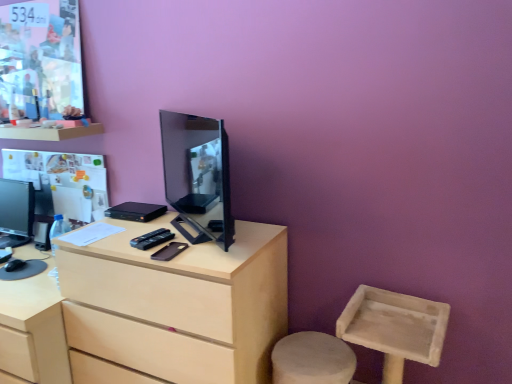
Question: Does matte black monitor at left, arranged as the 2th television when viewed from the right, have a smaller size compared to matte black tv at center, the second television when ordered from left to right?

Choices:
 (A) no
 (B) yes

Answer: (B)

Question: Is matte black tv at center, the second television when ordered from left to right, a part of matte black monitor at left, which is the 1th television from back to front?

Choices:
 (A) yes
 (B) no

Answer: (B)

Question: Is there a large distance between matte black monitor at left, which is the 1th television from back to front, and matte black tv at center, which is the first television in right-to-left order?

Choices:
 (A) no
 (B) yes

Answer: (A)

Question: Does matte black monitor at left, arranged as the 2th television when viewed from the right, have a larger size compared to matte black tv at center, marked as the second television in a back-to-front arrangement?

Choices:
 (A) no
 (B) yes

Answer: (A)

Question: Is matte black monitor at left, the 1th television in the left-to-right sequence, next to matte black tv at center, marked as the second television in a back-to-front arrangement, and touching it?

Choices:
 (A) no
 (B) yes

Answer: (A)

Question: Does matte black monitor at left, the 1th television in the left-to-right sequence, have a greater width compared to matte black tv at center, which is the first television in right-to-left order?

Choices:
 (A) yes
 (B) no

Answer: (A)

Question: Can you confirm if black matte mobile phone at center is positioned to the left of light wood desk at center?

Choices:
 (A) yes
 (B) no

Answer: (B)

Question: Is black matte mobile phone at center facing away from light wood desk at center?

Choices:
 (A) yes
 (B) no

Answer: (A)

Question: Is black matte mobile phone at center in front of light wood desk at center?

Choices:
 (A) no
 (B) yes

Answer: (A)

Question: Is black matte mobile phone at center not within light wood desk at center?

Choices:
 (A) no
 (B) yes

Answer: (A)

Question: Is black matte mobile phone at center bigger than light wood desk at center?

Choices:
 (A) no
 (B) yes

Answer: (A)

Question: Can you confirm if black matte mobile phone at center is wider than light wood desk at center?

Choices:
 (A) yes
 (B) no

Answer: (B)

Question: Would you say matte black tv at center, arranged as the first television when viewed from the front, is outside black matte mobile phone at center?

Choices:
 (A) no
 (B) yes

Answer: (B)